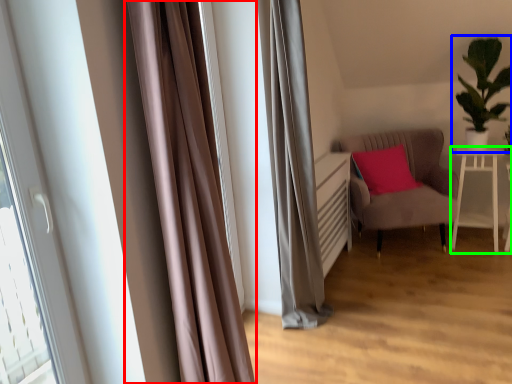
Question: Based on their relative distances, which object is nearer to curtain (highlighted by a red box)? Choose from houseplant (highlighted by a blue box) and table (highlighted by a green box).

Choices:
 (A) houseplant
 (B) table

Answer: (A)